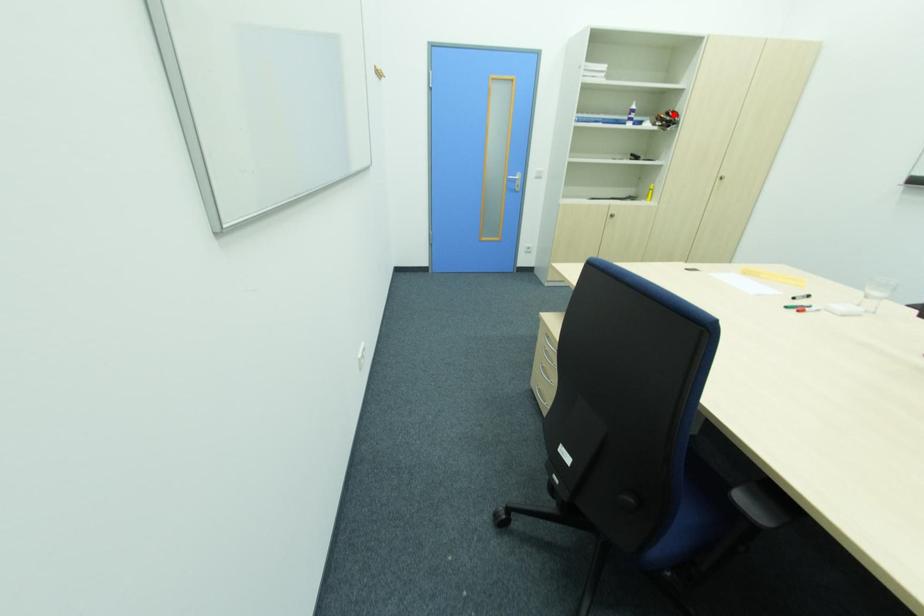
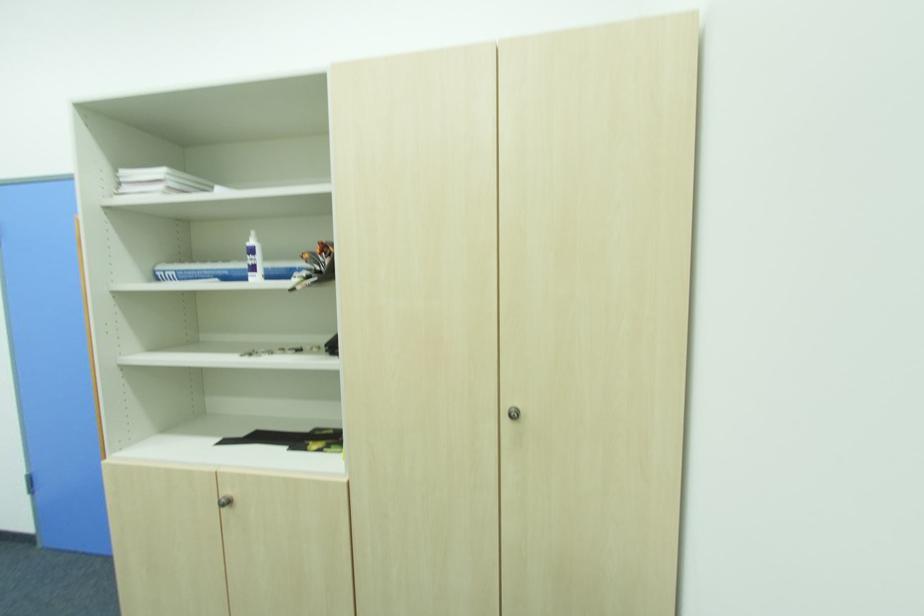
In the second image, find the point that corresponds to the highlighted location in the first image.

(321, 252)